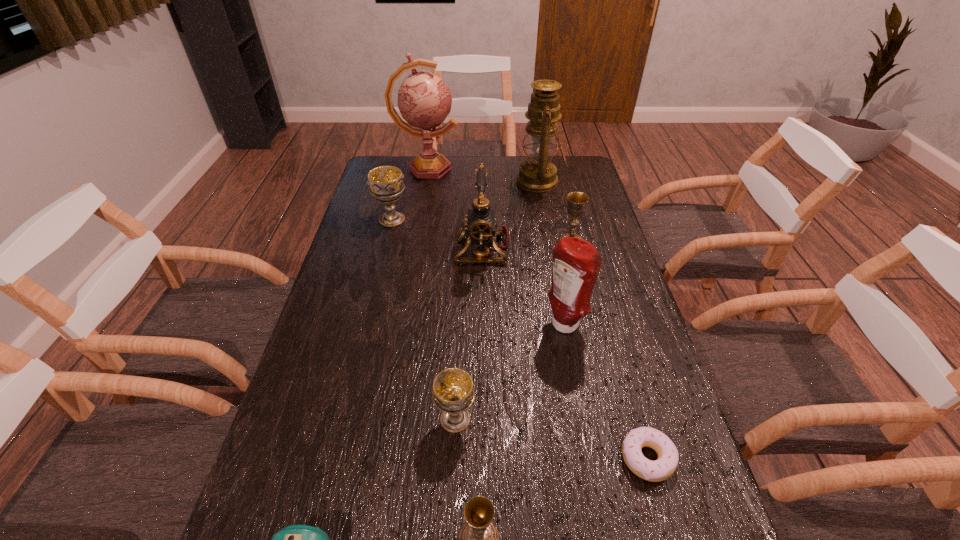
This screenshot has width=960, height=540. I want to click on vacant space that satisfies the following two spatial constraints: 1. on the front-facing side of the pink globe; 2. on the front side of the farthest chalice, so click(x=418, y=219).

The image size is (960, 540). Find the location of `free location that satisfies the following two spatial constraints: 1. on the front of the black telephone, featuring the rotary dial; 2. on the right side of the doughnut`. free location that satisfies the following two spatial constraints: 1. on the front of the black telephone, featuring the rotary dial; 2. on the right side of the doughnut is located at coordinates (483, 458).

This screenshot has height=540, width=960. I want to click on vacant space that satisfies the following two spatial constraints: 1. on the front-facing side of the pink globe; 2. on the right side of the white doughnut, so click(x=376, y=458).

I want to click on vacant point that satisfies the following two spatial constraints: 1. on the front-facing side of the globe; 2. on the right side of the condiment, so click(x=399, y=326).